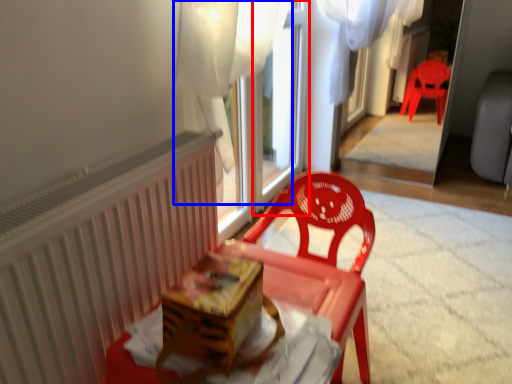
Question: Which object appears farthest to the camera in this image, window frame (highlighted by a red box) or curtain (highlighted by a blue box)?

Choices:
 (A) window frame
 (B) curtain

Answer: (A)